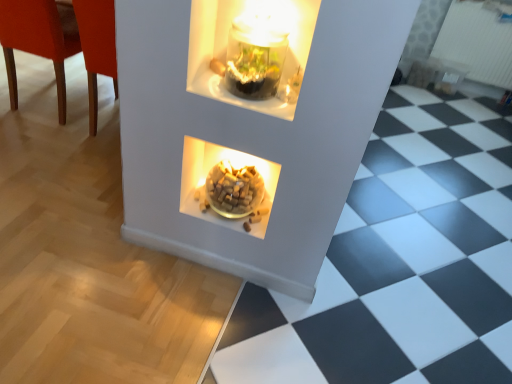
Question: Should I look upward or downward to see white textured radiator at upper right?

Choices:
 (A) down
 (B) up

Answer: (B)

Question: Can you confirm if matte wood chair at left is wider than translucent glass bowl at center?

Choices:
 (A) yes
 (B) no

Answer: (A)

Question: Does matte wood chair at left have a smaller size compared to translucent glass bowl at center?

Choices:
 (A) no
 (B) yes

Answer: (A)

Question: Is matte wood chair at left touching translucent glass bowl at center?

Choices:
 (A) no
 (B) yes

Answer: (A)

Question: Is translucent glass bowl at center a part of matte wood chair at left?

Choices:
 (A) no
 (B) yes

Answer: (A)

Question: From a real-world perspective, is matte wood chair at left on translucent glass bowl at center?

Choices:
 (A) no
 (B) yes

Answer: (A)

Question: Is matte wood chair at left located outside translucent glass bowl at center?

Choices:
 (A) yes
 (B) no

Answer: (A)

Question: Could you tell me if white textured radiator at upper right is turned towards matte wood chair at left?

Choices:
 (A) yes
 (B) no

Answer: (B)

Question: Considering the relative positions of white textured radiator at upper right and matte wood chair at left in the image provided, is white textured radiator at upper right to the right of matte wood chair at left from the viewer's perspective?

Choices:
 (A) yes
 (B) no

Answer: (A)

Question: Is white textured radiator at upper right further to camera compared to matte wood chair at left?

Choices:
 (A) no
 (B) yes

Answer: (B)

Question: Is white textured radiator at upper right smaller than matte wood chair at left?

Choices:
 (A) no
 (B) yes

Answer: (B)

Question: Can matte wood chair at left be found inside white textured radiator at upper right?

Choices:
 (A) no
 (B) yes

Answer: (A)

Question: Is white textured radiator at upper right to the left of matte wood chair at left from the viewer's perspective?

Choices:
 (A) yes
 (B) no

Answer: (B)

Question: Is matte wood chair at left further to the viewer compared to white textured radiator at upper right?

Choices:
 (A) yes
 (B) no

Answer: (B)